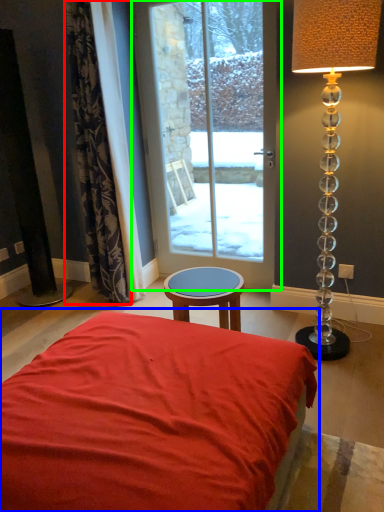
Question: Which is farther away from curtain (highlighted by a red box)? bed (highlighted by a blue box) or door (highlighted by a green box)?

Choices:
 (A) bed
 (B) door

Answer: (A)